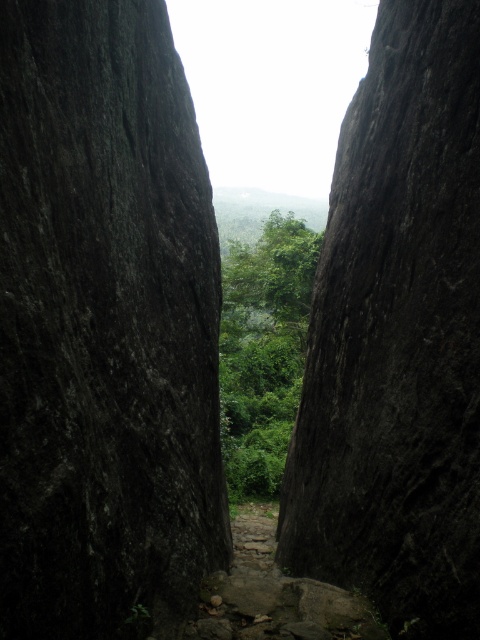
Question: Does dark gray rough rock face at center have a lesser width compared to green leafy tree at center?

Choices:
 (A) no
 (B) yes

Answer: (B)

Question: Which point is farther from the camera taking this photo?

Choices:
 (A) (163, 244)
 (B) (233, 497)

Answer: (B)

Question: Is dark gray rough rock face at center smaller than green leafy tree at center?

Choices:
 (A) no
 (B) yes

Answer: (B)

Question: From the image, what is the correct spatial relationship of dark gray rough rock face at center in relation to green leafy tree at center?

Choices:
 (A) right
 (B) left

Answer: (B)

Question: Which object is farther from the camera taking this photo?

Choices:
 (A) green leafy tree at center
 (B) dark gray rough rock face at center

Answer: (A)